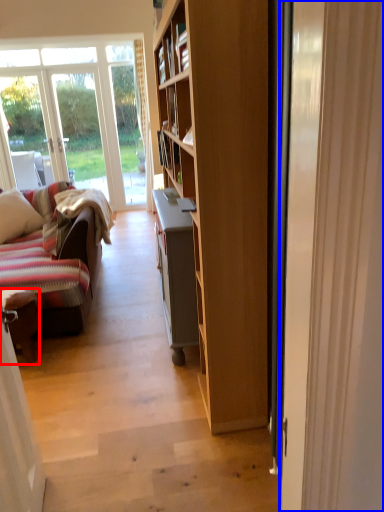
Question: Which of the following is the farthest to the observer, chair (highlighted by a red box) or door (highlighted by a blue box)?

Choices:
 (A) chair
 (B) door

Answer: (A)